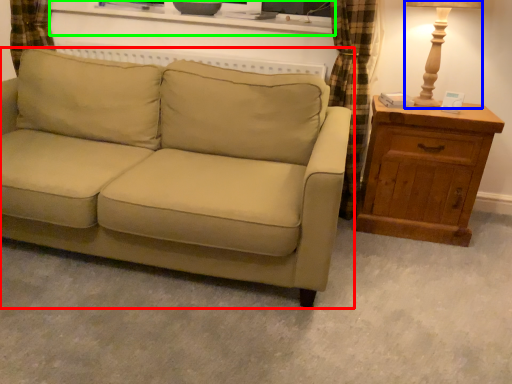
Question: Based on their relative distances, which object is farther from studio couch (highlighted by a red box)? Choose from table lamp (highlighted by a blue box) and entertainment center (highlighted by a green box).

Choices:
 (A) table lamp
 (B) entertainment center

Answer: (A)